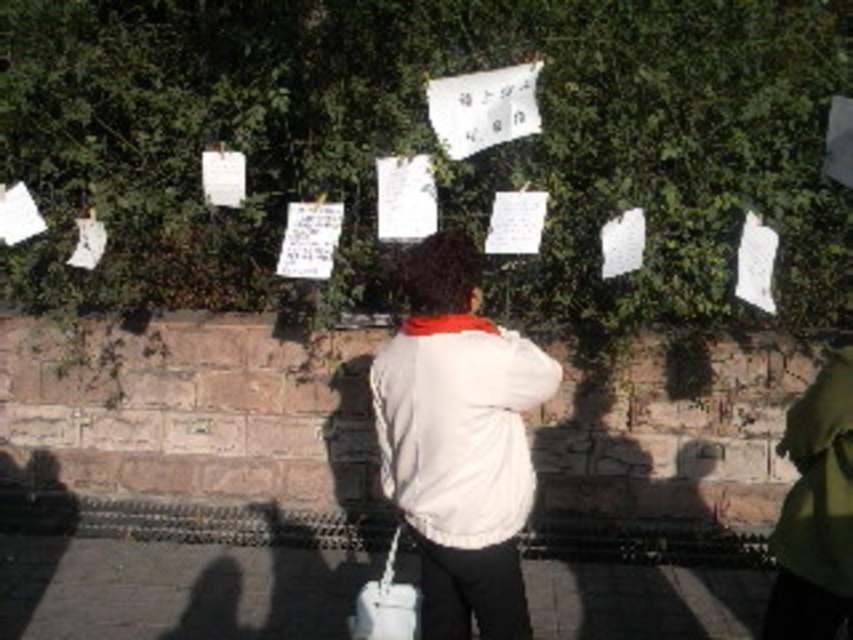
What do you see at coordinates (428, 144) in the screenshot?
I see `green leafy hedge at upper center` at bounding box center [428, 144].

Is point (775, 22) closer to viewer compared to point (467, 625)?

That is False.

Between point (735, 243) and point (456, 436), which one is positioned behind?

Positioned behind is point (735, 243).

The width and height of the screenshot is (853, 640). I want to click on green leafy hedge at upper center, so click(428, 144).

From the picture: Does white fabric jacket at center appear on the left side of white fabric at center?

Indeed, white fabric jacket at center is positioned on the left side of white fabric at center.

Who is more forward, (469, 417) or (838, 563)?

Point (838, 563)

Locate an element on the screen. white fabric jacket at center is located at coordinates (459, 440).

Does green leafy hedge at upper center have a lesser width compared to white fabric at center?

In fact, green leafy hedge at upper center might be wider than white fabric at center.

Does green leafy hedge at upper center come behind white fabric at center?

Yes, it is.

Is point (4, 112) closer to camera compared to point (840, 545)?

No.

Find the location of a particular element. green leafy hedge at upper center is located at coordinates (428, 144).